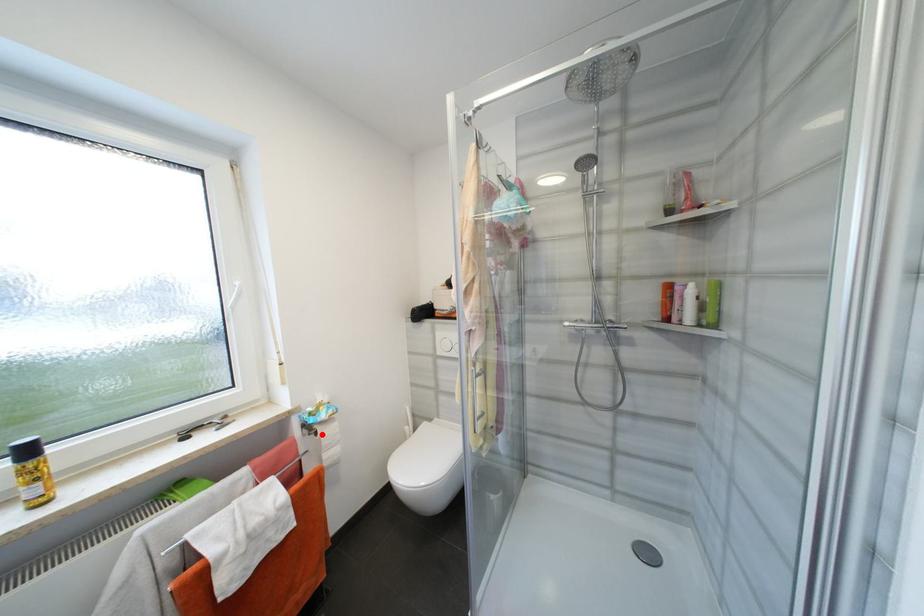
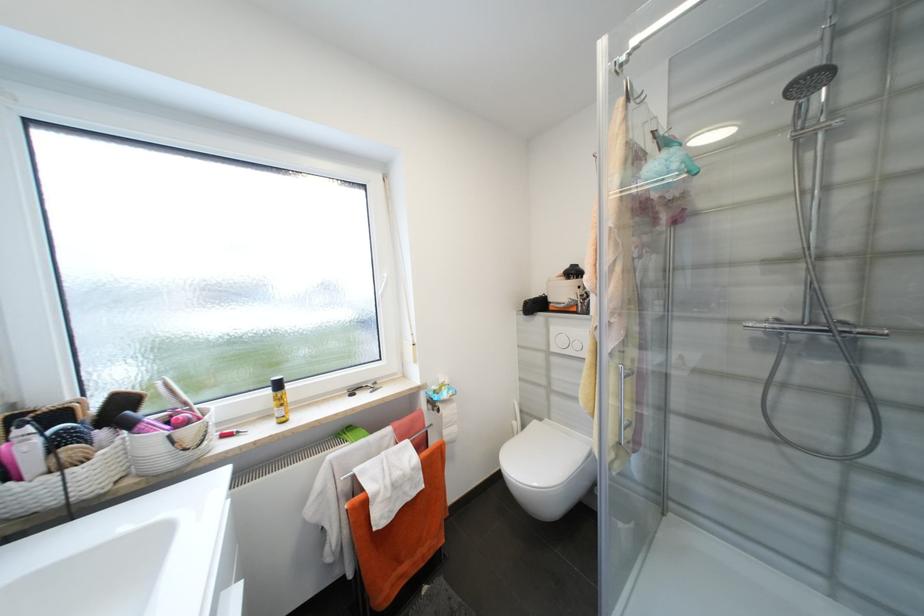
Question: I am providing you with two images of the same scene from different viewpoints. In image1, a red point is highlighted. Considering the same 3D point in image2, which of the following is correct?

Choices:
 (A) It is closer
 (B) It is farther

Answer: (B)